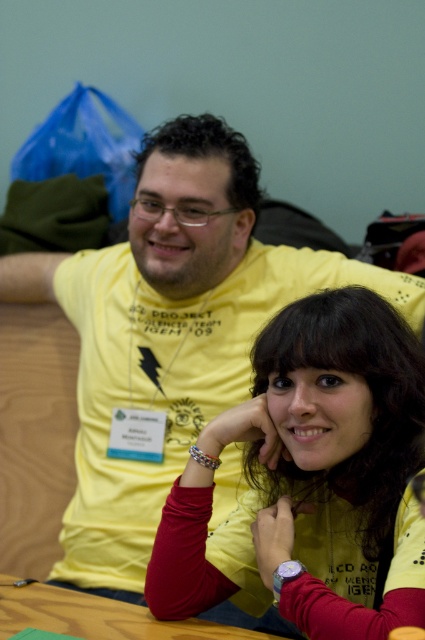
You are organizing a charity event where bracelets are donated. The metallic bracelet at lower center and the multicolored fabric bracelet at lower center are available. If you need to choose the one with the bigger size for a wrist with limited flexibility, which bracelet should you pick?

The metallic bracelet at lower center has a larger size compared to the multicolored fabric bracelet at lower center, so you should choose the metallic bracelet at lower center for a wrist with limited flexibility.

You are designing a layout for a promotional poster and need to place the matte yellow shirt at center and the multicolored fabric bracelet at lower center. Given their sizes, which object should be placed higher on the poster to maintain visual hierarchy?

The matte yellow shirt at center should be placed higher on the poster because it is taller than the multicolored fabric bracelet at lower center, ensuring visual hierarchy is maintained.